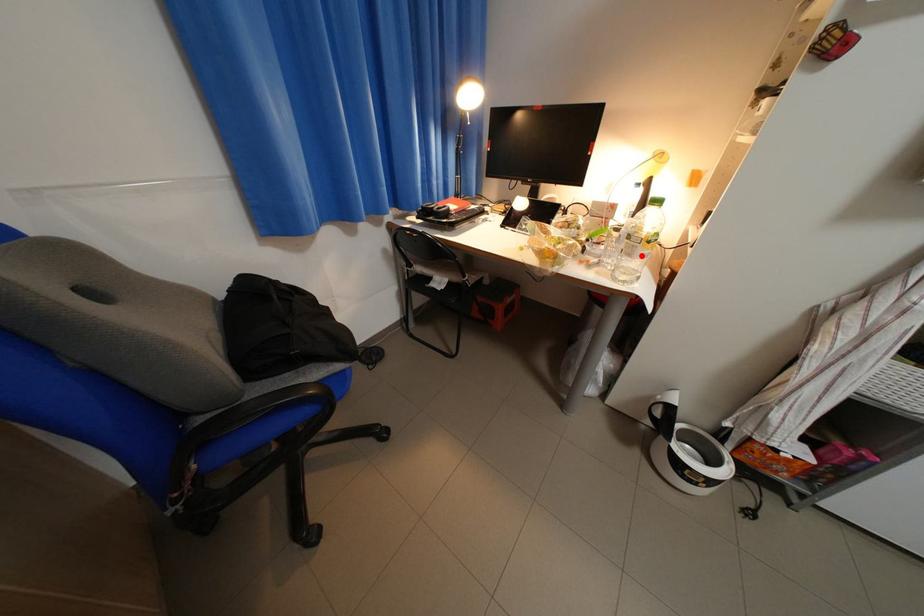
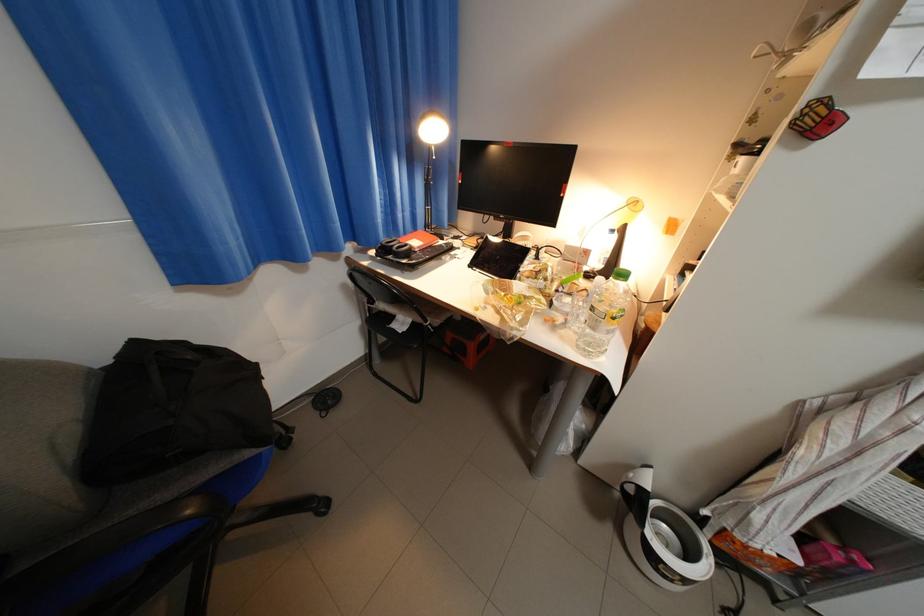
Find the pixel in the second image that matches the highlighted location in the first image.

(605, 330)